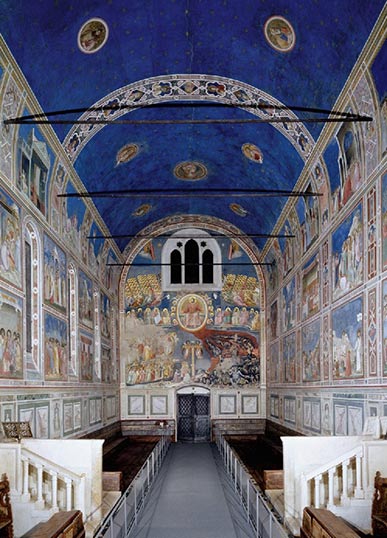
Identify the location of right handrail. This screenshot has width=387, height=538. (337, 457).